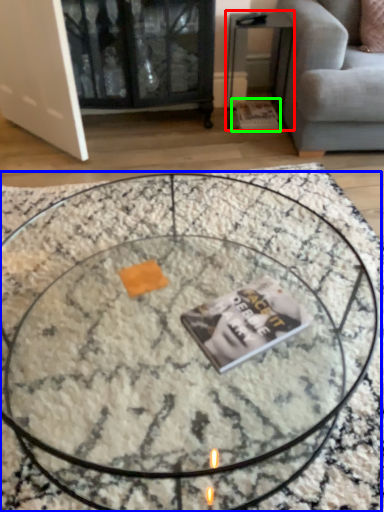
Question: Which object is the closest to the side table (highlighted by a red box)? Choose among these: coffee table (highlighted by a blue box) or magazine (highlighted by a green box).

Choices:
 (A) coffee table
 (B) magazine

Answer: (B)